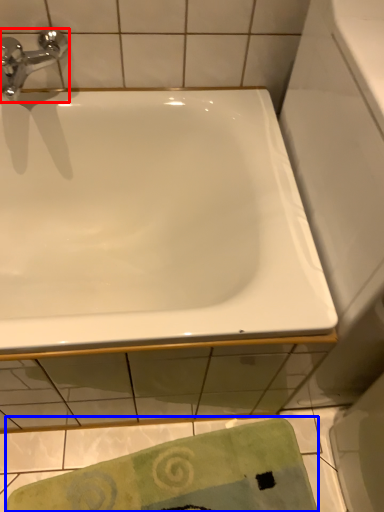
Question: Which object appears farthest to the camera in this image, tap (highlighted by a red box) or beach towel (highlighted by a blue box)?

Choices:
 (A) tap
 (B) beach towel

Answer: (B)